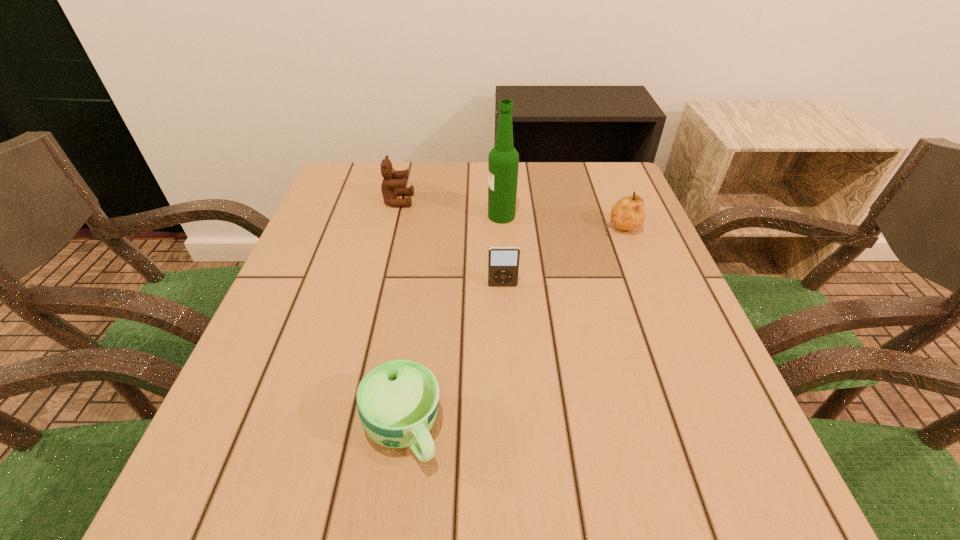
In order to click on unoccupied position between the fourth farthest object and the pear in this screenshot , I will do `click(562, 257)`.

Identify the location of empty location between the rightmost object and the beer bottle. Image resolution: width=960 pixels, height=540 pixels. (561, 222).

Where is `vacant space that's between the teddy bear and the iPod`? vacant space that's between the teddy bear and the iPod is located at coordinates (450, 243).

This screenshot has width=960, height=540. In order to click on object that stands as the third closest to the nearest object in this screenshot , I will do `click(394, 184)`.

Identify which object is located as the fourth nearest to the teddy bear. Please provide its 2D coordinates. Your answer should be formatted as a tuple, i.e. [(x, y)], where the tuple contains the x and y coordinates of a point satisfying the conditions above.

[(397, 400)]

Locate an element on the screen. The height and width of the screenshot is (540, 960). free spot that satisfies the following two spatial constraints: 1. on the label of the tallest object; 2. on the front side of the cup is located at coordinates (515, 430).